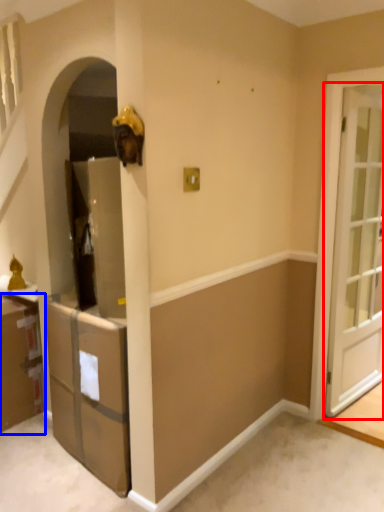
Question: Among these objects, which one is farthest to the camera, door (highlighted by a red box) or cabinetry (highlighted by a blue box)?

Choices:
 (A) door
 (B) cabinetry

Answer: (B)